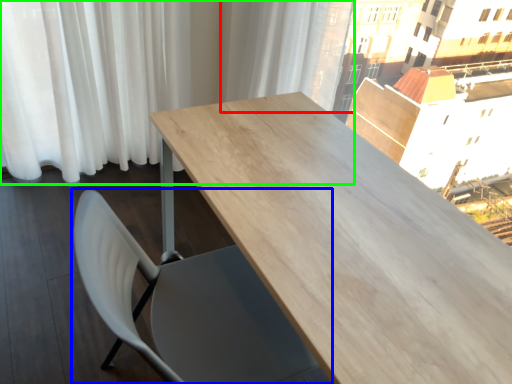
Question: Which is farther away from curtain (highlighted by a red box)? chair (highlighted by a blue box) or curtain (highlighted by a green box)?

Choices:
 (A) chair
 (B) curtain

Answer: (A)